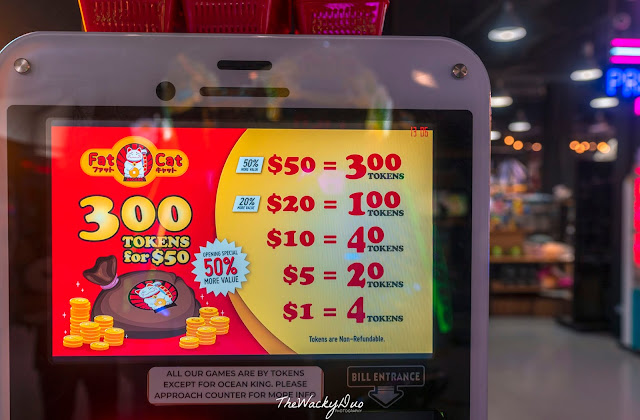
The height and width of the screenshot is (420, 640). I want to click on ceiling, so click(x=443, y=16).